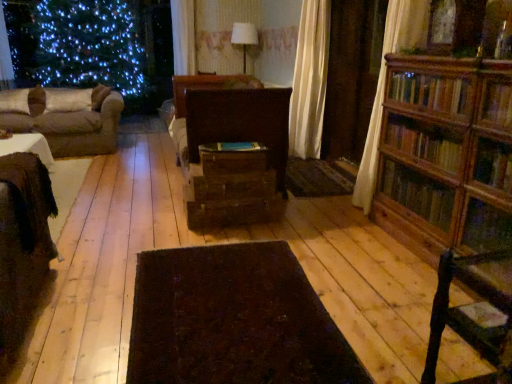
Describe the element at coordinates (244, 38) in the screenshot. I see `white fabric lampshade at upper center` at that location.

Locate an element on the screen. wooden bookcase at right is located at coordinates (455, 175).

Where is `brown wood drawer at center, positioned as the 2th drawer in top-to-bottom order`? Image resolution: width=512 pixels, height=384 pixels. brown wood drawer at center, positioned as the 2th drawer in top-to-bottom order is located at coordinates (233, 186).

From the image's perspective, does dark wool rug at center appear higher than blue matte book at center?

No, from the image's perspective, dark wool rug at center is not on top of blue matte book at center.

In order to click on wide that appears on the left of blue matte book at center in this screenshot , I will do `click(233, 320)`.

Is dark wool rug at center oriented away from blue matte book at center?

No, dark wool rug at center's orientation is not away from blue matte book at center.

Does dark wool rug at center appear on the left side of blue matte book at center?

Indeed, dark wool rug at center is positioned on the left side of blue matte book at center.

Do you think brown fabric couch at left is within white fabric lampshade at upper center, or outside of it?

brown fabric couch at left is outside white fabric lampshade at upper center.

From the image's perspective, who appears lower, brown fabric couch at left or white fabric lampshade at upper center?

brown fabric couch at left is shown below in the image.

In the image, there is a brown fabric couch at left. Where is `lamp above it (from the image's perspective)`? lamp above it (from the image's perspective) is located at coordinates (244, 38).

Consider the image. Does brown fabric couch at left turn towards white fabric lampshade at upper center?

No, brown fabric couch at left is not turned towards white fabric lampshade at upper center.

What's the angular difference between green fabric curtain at upper left and wooden drawer at center, which is the second drawer in bottom-to-top order,'s facing directions?

The angle between the facing direction of green fabric curtain at upper left and the facing direction of wooden drawer at center, which is the second drawer in bottom-to-top order, is 127 degrees.

Looking at the image, does green fabric curtain at upper left seem bigger or smaller compared to wooden drawer at center, which appears as the 1th drawer when viewed from the top?

Clearly, green fabric curtain at upper left is larger in size than wooden drawer at center, which appears as the 1th drawer when viewed from the top.

The height and width of the screenshot is (384, 512). What are the coordinates of `drawer that is the 2nd one when counting forward from the green fabric curtain at upper left` in the screenshot? It's located at (233, 160).

Who is shorter, green fabric curtain at upper left or wooden drawer at center, which appears as the 1th drawer when viewed from the top?

wooden drawer at center, which appears as the 1th drawer when viewed from the top, is shorter.

Would you say blue matte book at center is a long distance from white fabric lampshade at upper center?

Yes, blue matte book at center and white fabric lampshade at upper center are quite far apart.

From the image's perspective, is blue matte book at center below white fabric lampshade at upper center?

Indeed, from the image's perspective, blue matte book at center is shown beneath white fabric lampshade at upper center.

Between blue matte book at center and white fabric lampshade at upper center, which one has less height?

With less height is blue matte book at center.

Can you tell me how much brown wood drawer at center, marked as the first drawer in a bottom-to-top arrangement, and wooden bookcase at right differ in facing direction?

They differ by 3.23 degrees in their facing directions.

From a real-world perspective, is brown wood drawer at center, positioned as the 2th drawer in top-to-bottom order, above or below wooden bookcase at right?

Clearly, from a real-world perspective, brown wood drawer at center, positioned as the 2th drawer in top-to-bottom order, is below wooden bookcase at right.

Which drawer is the 2nd one when counting from the left side of the wooden bookcase at right? Please provide its 2D coordinates.

[(233, 186)]

Based on their sizes in the image, would you say brown wood drawer at center, positioned as the 2th drawer in top-to-bottom order, is bigger or smaller than wooden bookcase at right?

In the image, brown wood drawer at center, positioned as the 2th drawer in top-to-bottom order, appears to be smaller than wooden bookcase at right.

Is blue matte book at center positioned beyond the bounds of wooden drawer at center, which appears as the 1th drawer when viewed from the top?

That's incorrect, blue matte book at center is not completely outside wooden drawer at center, which appears as the 1th drawer when viewed from the top.

Does blue matte book at center have a lesser width compared to wooden drawer at center, which appears as the 1th drawer when viewed from the top?

Yes, blue matte book at center is thinner than wooden drawer at center, which appears as the 1th drawer when viewed from the top.

In terms of height, does blue matte book at center look taller or shorter compared to wooden drawer at center, which appears as the 1th drawer when viewed from the top?

blue matte book at center is shorter than wooden drawer at center, which appears as the 1th drawer when viewed from the top.

Measure the distance between dark wool rug at center and dark brown wooden chair at lower right.

The distance of dark wool rug at center from dark brown wooden chair at lower right is 32.56 inches.

Is dark wool rug at center not close to dark brown wooden chair at lower right?

No.

Considering the sizes of objects dark wool rug at center and dark brown wooden chair at lower right in the image provided, who is bigger, dark wool rug at center or dark brown wooden chair at lower right?

dark brown wooden chair at lower right.

Is dark wool rug at center completely or partially outside of dark brown wooden chair at lower right?

Indeed, dark wool rug at center is completely outside dark brown wooden chair at lower right.

Identify the location of wide below the blue matte book at center (from the image's perspective). (233, 320).

Where is `lamp above the brown fabric couch at left (from a real-world perspective)`? The width and height of the screenshot is (512, 384). lamp above the brown fabric couch at left (from a real-world perspective) is located at coordinates pos(244,38).

Based on their spatial positions, is green fabric curtain at upper left or dark wool rug at center further from brown wood drawer at center, positioned as the 2th drawer in top-to-bottom order?

green fabric curtain at upper left lies further to brown wood drawer at center, positioned as the 2th drawer in top-to-bottom order, than the other object.

Which object lies further to the anchor point wooden drawer at center, which is the second drawer in bottom-to-top order, blue matte book at center or dark brown wooden chair at lower right?

The object further to wooden drawer at center, which is the second drawer in bottom-to-top order, is dark brown wooden chair at lower right.

When comparing their distances from green fabric curtain at upper left, does blue matte book at center or dark wool rug at center seem further?

dark wool rug at center.

Looking at this image, when comparing their distances from brown fabric couch at left, does blue matte book at center or green fabric curtain at upper left seem closer?

green fabric curtain at upper left lies closer to brown fabric couch at left than the other object.

When comparing their distances from dark brown wooden chair at lower right, does white fabric lampshade at upper center or wooden drawer at center, which is the second drawer in bottom-to-top order, seem closer?

wooden drawer at center, which is the second drawer in bottom-to-top order, is positioned closer to the anchor dark brown wooden chair at lower right.

Considering their positions, is dark wool rug at center positioned closer to green fabric curtain at upper left than wooden drawer at center, which is the second drawer in bottom-to-top order?

wooden drawer at center, which is the second drawer in bottom-to-top order, is closer to green fabric curtain at upper left.

In the scene shown: Estimate the real-world distances between objects in this image. Which object is further from green fabric curtain at upper left, dark wool rug at center or brown wood drawer at center, positioned as the 2th drawer in top-to-bottom order?

Among the two, dark wool rug at center is located further to green fabric curtain at upper left.

Which object lies further to the anchor point green fabric curtain at upper left, wooden bookcase at right or wooden drawer at center, which is the second drawer in bottom-to-top order?

wooden bookcase at right is further to green fabric curtain at upper left.

Where is `book that lies between dark wood cabinet at center and brown wood drawer at center, positioned as the 2th drawer in top-to-bottom order, from top to bottom`? The image size is (512, 384). book that lies between dark wood cabinet at center and brown wood drawer at center, positioned as the 2th drawer in top-to-bottom order, from top to bottom is located at coordinates (233, 147).

Identify the location of entertainment center located between dark brown wooden chair at lower right and white fabric lampshade at upper center in the depth direction. (231, 152).

Locate an element on the screen. The height and width of the screenshot is (384, 512). studio couch between blue matte book at center and white fabric lampshade at upper center from front to back is located at coordinates (65, 118).

Find the location of a particular element. drawer between brown wood drawer at center, positioned as the 2th drawer in top-to-bottom order, and wooden bookcase at right is located at coordinates (233, 160).